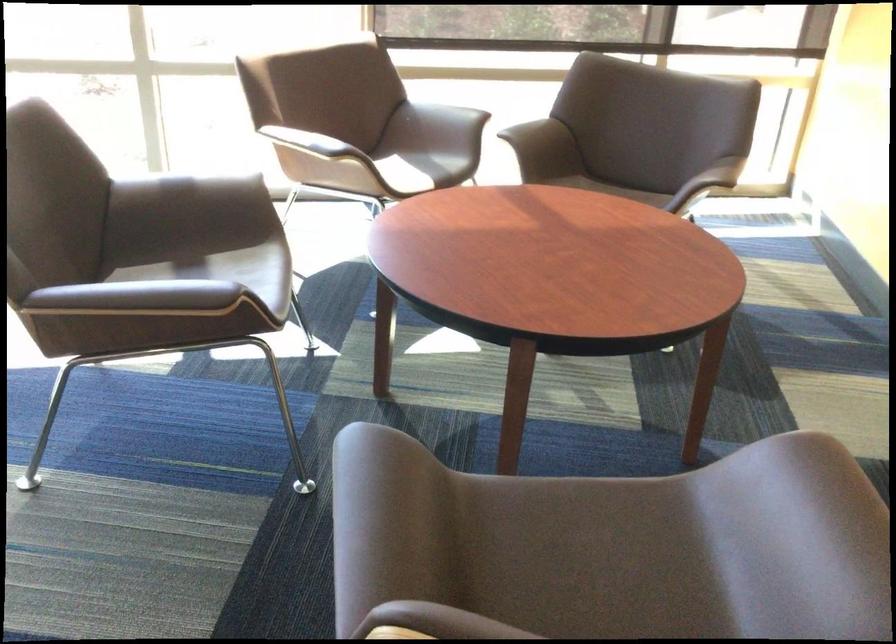
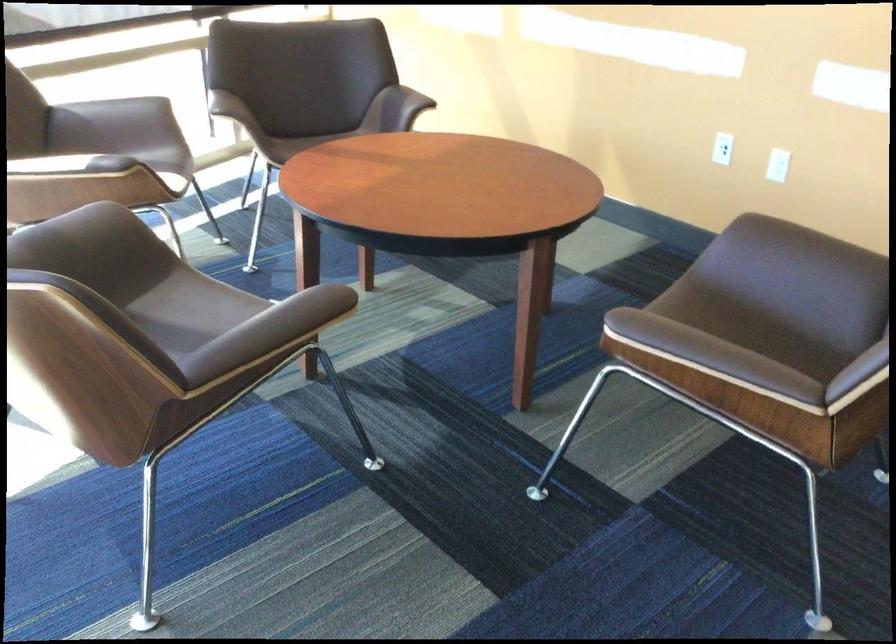
Locate, in the second image, the point that corresponds to (246,276) in the first image.

(191, 310)